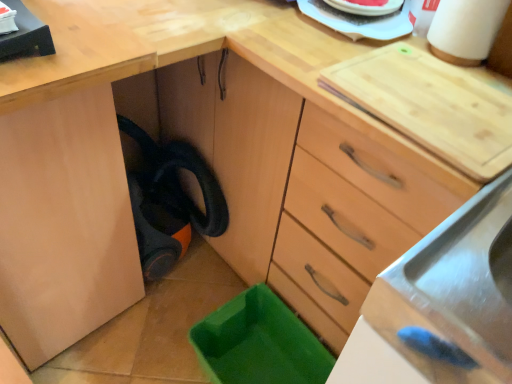
Question: Is white matte paper towel at upper right taller or shorter than stainless steel sink at lower right?

Choices:
 (A) short
 (B) tall

Answer: (B)

Question: In the image, is white matte paper towel at upper right on the left side or the right side of stainless steel sink at lower right?

Choices:
 (A) right
 (B) left

Answer: (A)

Question: From the image's perspective, is white matte paper towel at upper right located above or below stainless steel sink at lower right?

Choices:
 (A) above
 (B) below

Answer: (A)

Question: Is stainless steel sink at lower right in front of or behind white matte paper towel at upper right in the image?

Choices:
 (A) front
 (B) behind

Answer: (A)

Question: Is stainless steel sink at lower right to the left or to the right of white matte paper towel at upper right in the image?

Choices:
 (A) right
 (B) left

Answer: (B)

Question: Considering the positions of point (502, 326) and point (452, 49), is point (502, 326) closer or farther from the camera than point (452, 49)?

Choices:
 (A) closer
 (B) farther

Answer: (A)

Question: From a real-world perspective, is stainless steel sink at lower right positioned above or below white matte paper towel at upper right?

Choices:
 (A) below
 (B) above

Answer: (A)